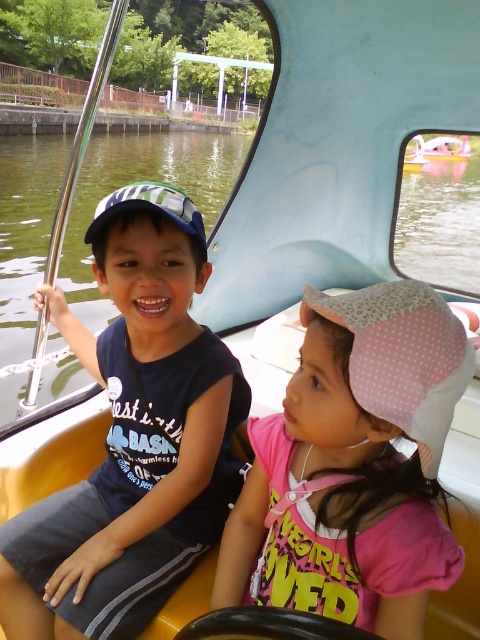
Question: Which object appears farthest from the camera in this image?

Choices:
 (A) pink dotted fabric hat at center
 (B) green water at center
 (C) pink fabric boat at center
 (D) matte black shirt at center

Answer: (C)

Question: Does green water at center appear under pink fabric boat at center?

Choices:
 (A) yes
 (B) no

Answer: (B)

Question: Is matte black shirt at center to the right of pink fabric boat at center from the viewer's perspective?

Choices:
 (A) yes
 (B) no

Answer: (B)

Question: Which of the following is the farthest from the observer?

Choices:
 (A) green water at center
 (B) pink dotted fabric hat at center
 (C) matte black shirt at center

Answer: (A)

Question: Estimate the real-world distances between objects in this image. Which object is closer to the green water at center?

Choices:
 (A) pink dotted fabric hat at center
 (B) pink fabric boat at center
 (C) matte black shirt at center

Answer: (A)

Question: Can you confirm if green water at center is positioned to the left of pink fabric boat at center?

Choices:
 (A) no
 (B) yes

Answer: (B)